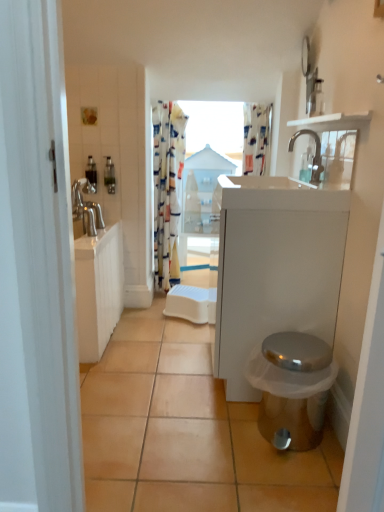
Identify the location of vacant region in front of shiny metallic toilet at lower right. [290, 478].